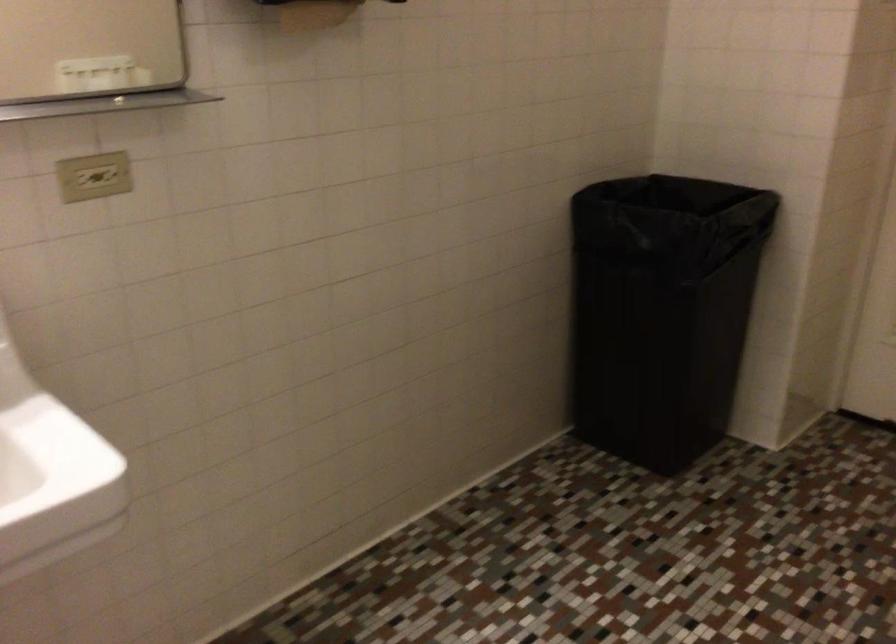
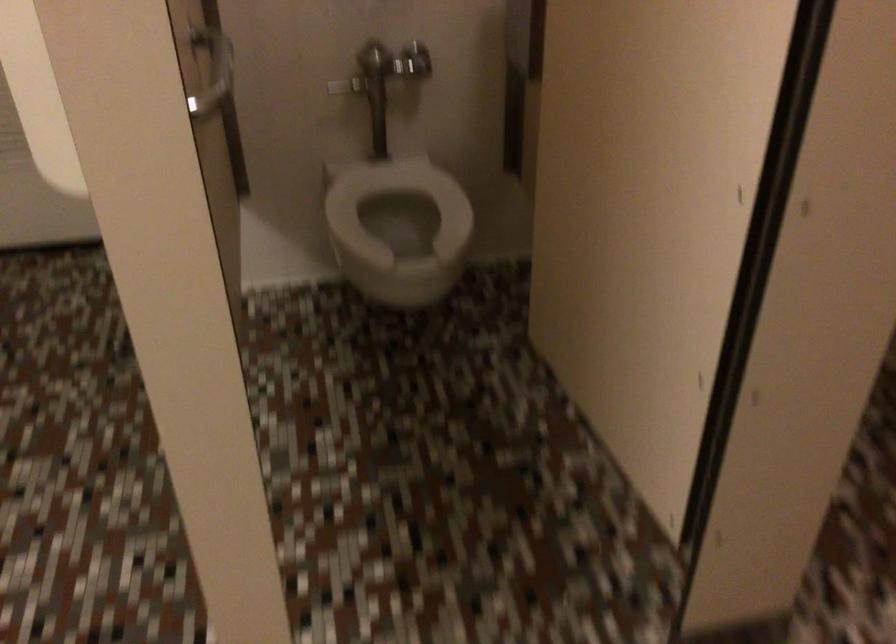
Based on the continuous images, in which direction is the camera rotating?

The camera's rotation is toward right-down.